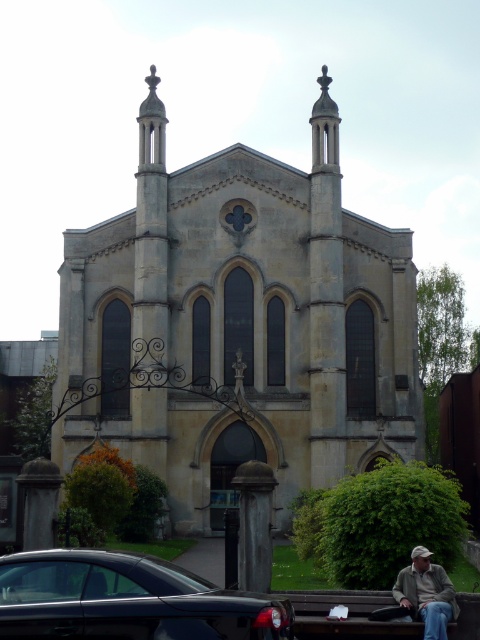
Question: Which point is closer to the camera?

Choices:
 (A) wooden bench at lower center
 (B) khaki fabric jacket at lower right
 (C) shiny black car at lower left

Answer: (C)

Question: Which of these objects is positioned closest to the light beige stone church at center?

Choices:
 (A) wooden bench at lower center
 (B) shiny black car at lower left
 (C) khaki fabric jacket at lower right

Answer: (C)

Question: Is shiny black car at lower left thinner than wooden bench at lower center?

Choices:
 (A) yes
 (B) no

Answer: (B)

Question: Is shiny black car at lower left closer to the viewer compared to wooden bench at lower center?

Choices:
 (A) yes
 (B) no

Answer: (A)

Question: Which object is closer to the camera taking this photo?

Choices:
 (A) shiny black car at lower left
 (B) wooden bench at lower center

Answer: (A)

Question: Does light beige stone church at center come behind shiny black car at lower left?

Choices:
 (A) yes
 (B) no

Answer: (A)